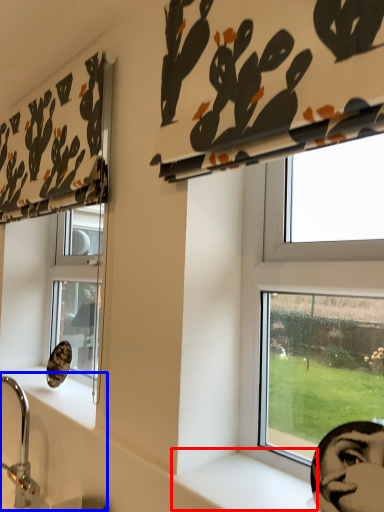
Question: Which object is further to the camera taking this photo, window sill (highlighted by a red box) or sink (highlighted by a blue box)?

Choices:
 (A) window sill
 (B) sink

Answer: (B)